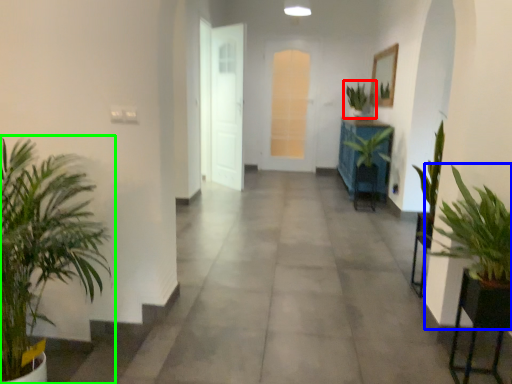
Question: Which object is positioned closest to houseplant (highlighted by a red box)? Select from houseplant (highlighted by a blue box) and houseplant (highlighted by a green box).

Choices:
 (A) houseplant
 (B) houseplant

Answer: (A)